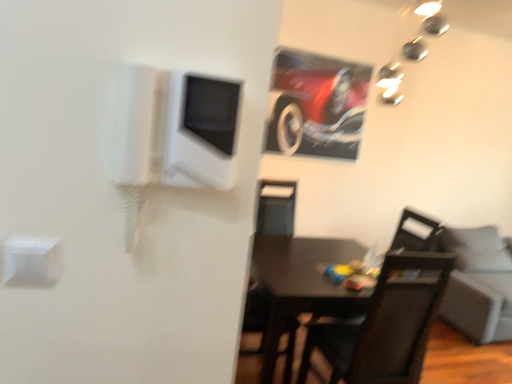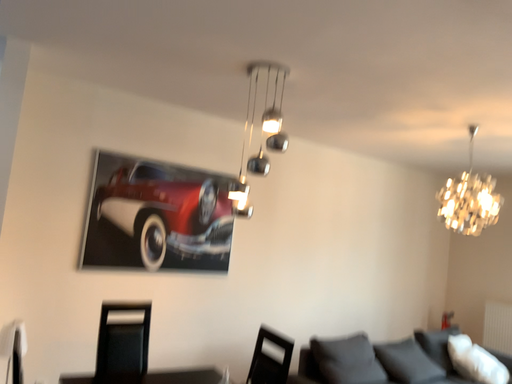
Question: Which way did the camera rotate in the video?

Choices:
 (A) rotated right
 (B) rotated left

Answer: (A)